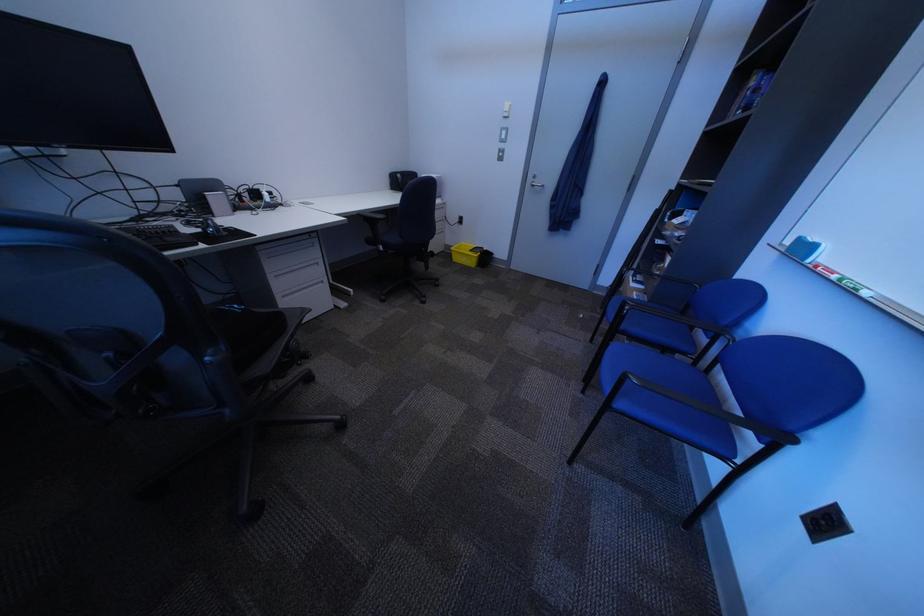
You are a GUI agent. You are given a task and a screenshot of the screen. Output one action in this format:
    pyautogui.click(x=<x>, y=<y>)
    Task: Click on the blue whiteboard eraser
    The width and height of the screenshot is (924, 616).
    Given the screenshot: What is the action you would take?
    pyautogui.click(x=74, y=91)